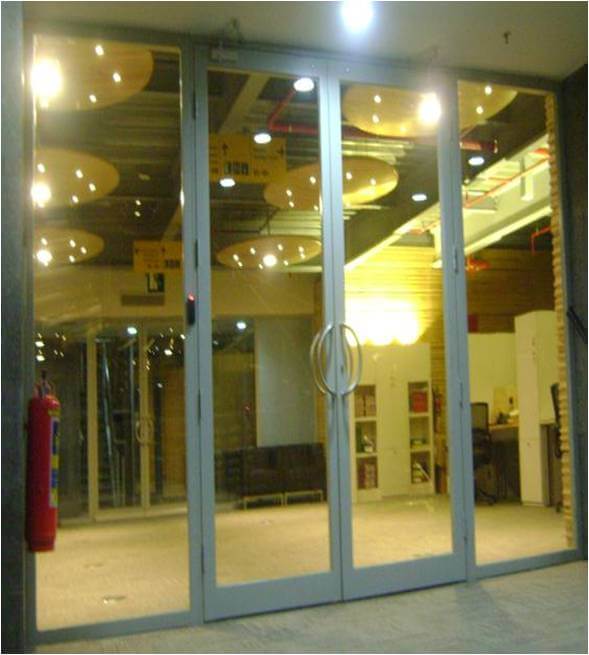
Where is `handle`? This screenshot has height=655, width=589. handle is located at coordinates (147, 431), (135, 430), (326, 384), (350, 384).